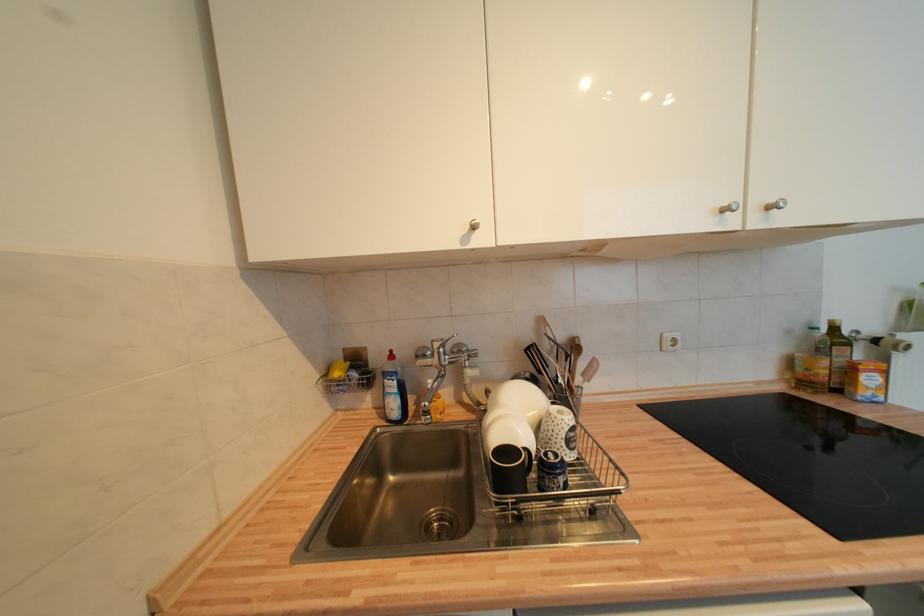
Find where to lift the blue soap bottle. Please return your answer as a coordinate pair (x, y).

(394, 391)